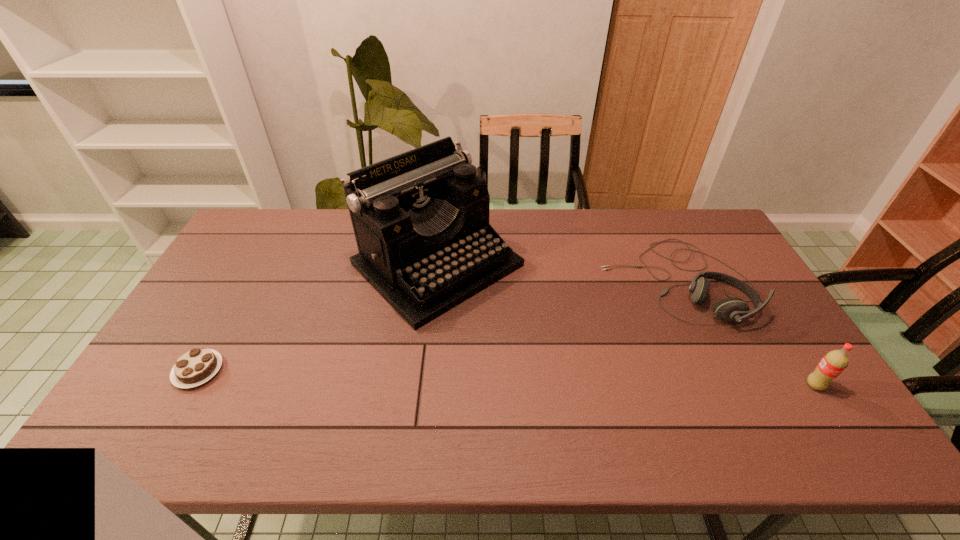
The width and height of the screenshot is (960, 540). What are the coordinates of `free space between the tallest object and the leftmost object` in the screenshot? It's located at (318, 318).

This screenshot has width=960, height=540. I want to click on free space between the second shortest object and the second tallest object, so click(746, 333).

Find the location of a particular element. vacant space that is in between the third shortest object and the typewriter is located at coordinates (626, 325).

Identify the location of free space between the headset and the third shortest object. Image resolution: width=960 pixels, height=540 pixels. (746, 333).

Locate an element on the screen. unoccupied area between the tallest object and the chocolate cake is located at coordinates tap(318, 318).

The height and width of the screenshot is (540, 960). I want to click on free area in between the headset and the second object from left to right, so click(557, 273).

The image size is (960, 540). I want to click on empty location between the third tallest object and the chocolate cake, so click(x=438, y=326).

Locate an element on the screen. Image resolution: width=960 pixels, height=540 pixels. free spot between the tallest object and the chocolate cake is located at coordinates pos(318,318).

Where is `empty location between the tallest object and the shortest object`? empty location between the tallest object and the shortest object is located at coordinates (318, 318).

Identify which object is the nearest to the soda. Please provide its 2D coordinates. Your answer should be formatted as a tuple, i.e. [(x, y)], where the tuple contains the x and y coordinates of a point satisfying the conditions above.

[(728, 309)]